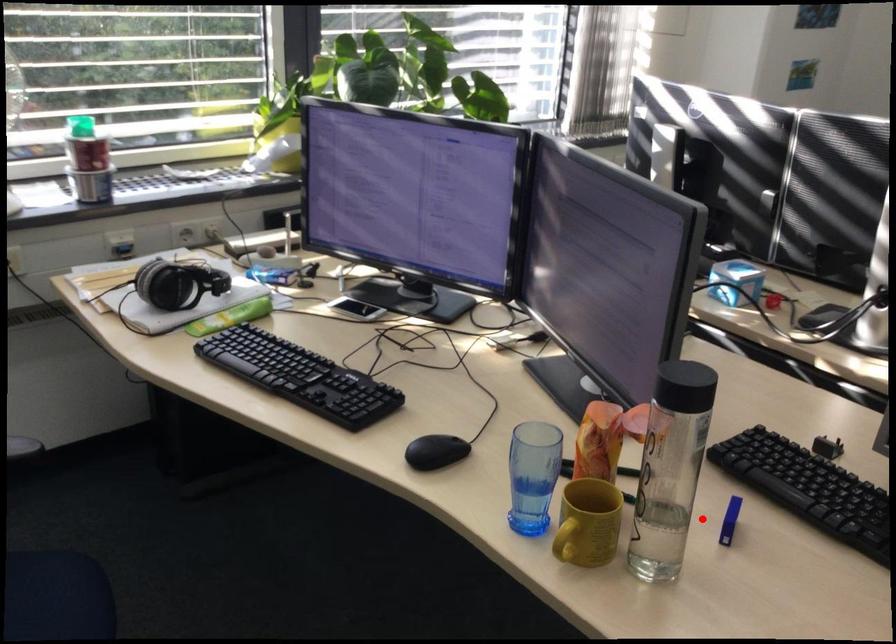
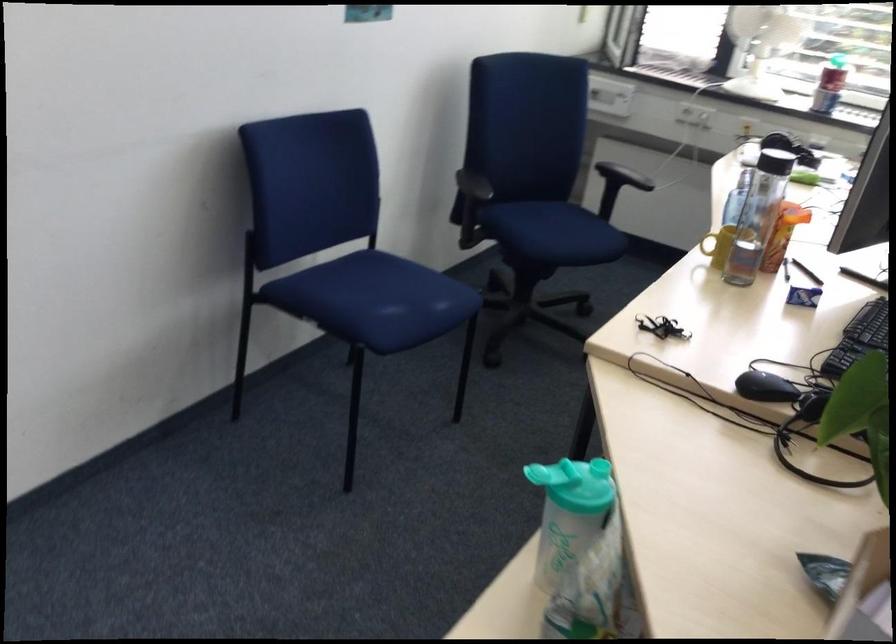
Question: I am providing you with two images of the same scene from different viewpoints. Given a red point in image1, look at the same physical point in image2. Is it:

Choices:
 (A) Closer to the viewpoint
 (B) Farther from the viewpoint

Answer: (B)